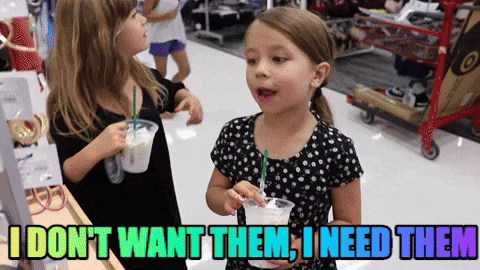
Find the location of a particular element. The height and width of the screenshot is (270, 480). racks is located at coordinates (457, 46).